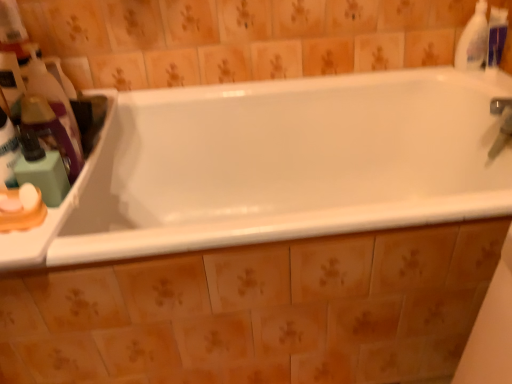
Question: Does white plastic bottle at upper right, which is the 1th cleaning product from right to left, appear on the left side of translucent plastic bottle at left, acting as the third cleaning product starting from the right?

Choices:
 (A) yes
 (B) no

Answer: (B)

Question: Does white plastic bottle at upper right, the third cleaning product in the left-to-right sequence, have a lesser height compared to translucent plastic bottle at left, marked as the 2th cleaning product in a back-to-front arrangement?

Choices:
 (A) yes
 (B) no

Answer: (A)

Question: Are white plastic bottle at upper right, which is the 1th cleaning product from right to left, and translucent plastic bottle at left, the 1th cleaning product when ordered from left to right, making contact?

Choices:
 (A) no
 (B) yes

Answer: (A)

Question: From a real-world perspective, is white plastic bottle at upper right, the third cleaning product viewed from the front, over translucent plastic bottle at left, marked as the 2th cleaning product in a back-to-front arrangement?

Choices:
 (A) no
 (B) yes

Answer: (A)

Question: Is there a large distance between white plastic bottle at upper right, the third cleaning product in the left-to-right sequence, and translucent plastic bottle at left, marked as the 2th cleaning product in a back-to-front arrangement?

Choices:
 (A) yes
 (B) no

Answer: (A)

Question: Is white plastic counter at left taller or shorter than matte green soap at left?

Choices:
 (A) tall
 (B) short

Answer: (B)

Question: Is white plastic counter at left inside or outside of matte green soap at left?

Choices:
 (A) outside
 (B) inside

Answer: (A)

Question: From a real-world perspective, is white plastic counter at left positioned above or below matte green soap at left?

Choices:
 (A) above
 (B) below

Answer: (B)

Question: From the image's perspective, is white plastic counter at left located above or below matte green soap at left?

Choices:
 (A) above
 (B) below

Answer: (A)

Question: Relative to matte green soap at left, is white plastic bottle at upper right, which is the 1th cleaning product from right to left, in front or behind?

Choices:
 (A) front
 (B) behind

Answer: (B)

Question: Considering the positions of white plastic bottle at upper right, the first cleaning product when ordered from back to front, and matte green soap at left in the image, is white plastic bottle at upper right, the first cleaning product when ordered from back to front, wider or thinner than matte green soap at left?

Choices:
 (A) thin
 (B) wide

Answer: (A)

Question: Considering the positions of white plastic bottle at upper right, which is the 1th cleaning product from right to left, and matte green soap at left in the image, is white plastic bottle at upper right, which is the 1th cleaning product from right to left, bigger or smaller than matte green soap at left?

Choices:
 (A) small
 (B) big

Answer: (B)

Question: From a real-world perspective, is white plastic bottle at upper right, the third cleaning product viewed from the front, above or below matte green soap at left?

Choices:
 (A) below
 (B) above

Answer: (B)

Question: Considering the positions of point (478, 61) and point (87, 220), is point (478, 61) closer or farther from the camera than point (87, 220)?

Choices:
 (A) closer
 (B) farther

Answer: (B)

Question: In terms of size, does white plastic bottle at upper right, the third cleaning product viewed from the front, appear bigger or smaller than white glossy bathtub at center?

Choices:
 (A) small
 (B) big

Answer: (A)